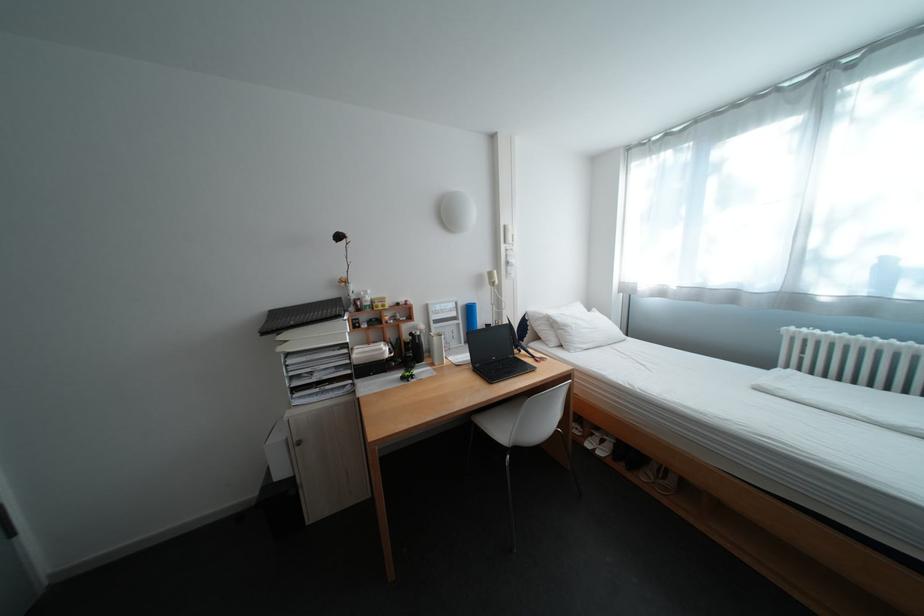
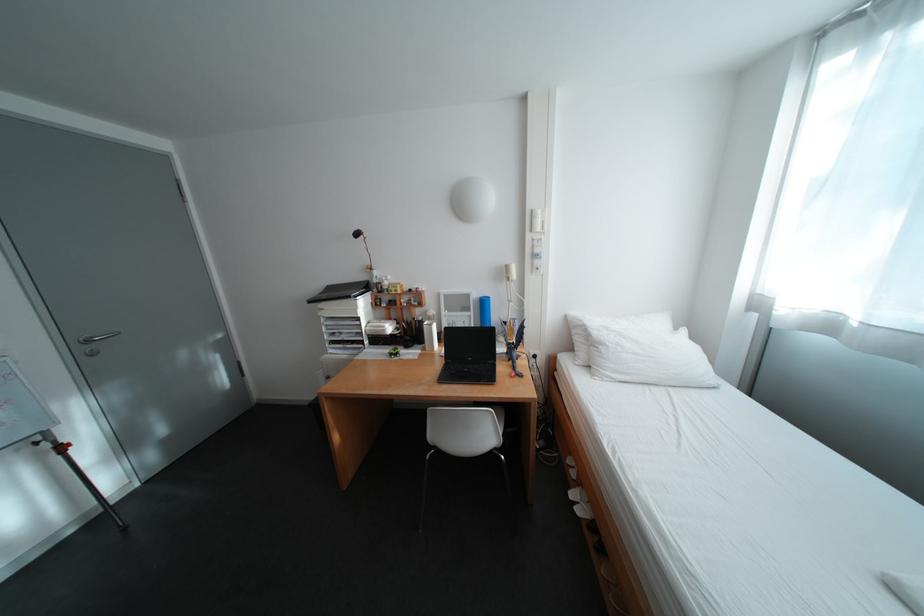
Question: I am providing you with two images of the same scene from different viewpoints. Please identify which objects are invisible in image2.

Choices:
 (A) blue water bottle
 (B) red adjustment knob
 (C) white pillow
 (D) none of these

Answer: (D)